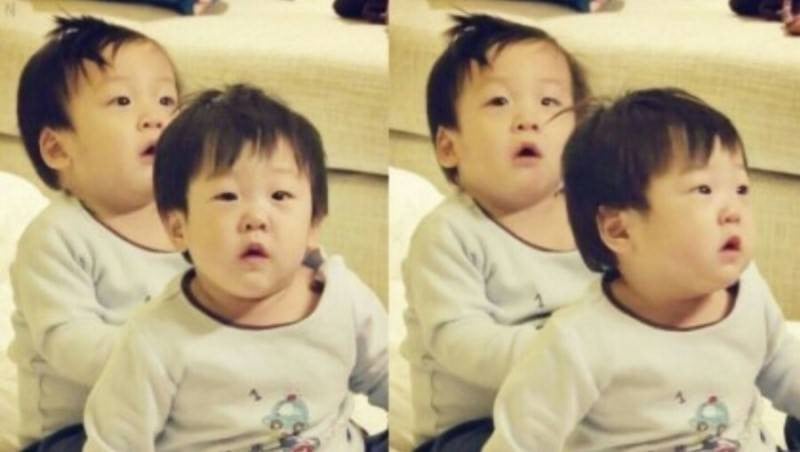
I want to click on couch, so click(298, 71).